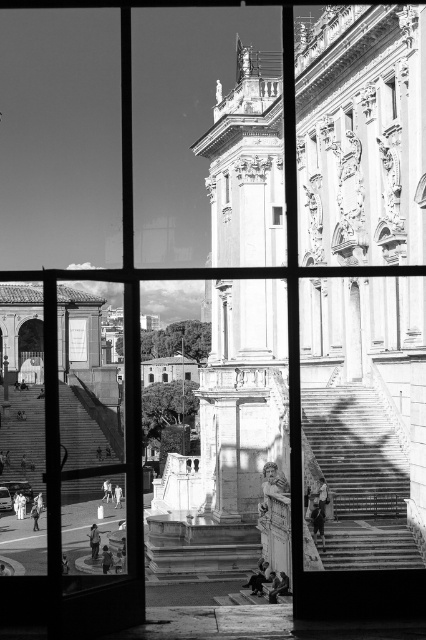
You are standing in front of a window divided into six sections by a grid. You notice two points marked on the window glass at coordinates point (313, 410) and point (66, 499). If you were to touch both points with your finger, which point would require your finger to be closer to the window?

Point (66, 499) would require your finger to be closer to the window because it is closer to the viewer than point (313, 410).

You are standing at the stone staircase at lower left and want to reach the transparent glass window at center. Given that the average walking speed is 1.4 meters per second, how many seconds will it take to walk directly to the window?

The distance between the stone staircase at lower left and the transparent glass window at center is 45.01 meters. At an average walking speed of 1.4 meters per second, it would take approximately 32.15 seconds to walk directly to the window.

You are standing inside a room and looking through the transparent glass window at center. You want to walk towards the stone staircase at lower left. Which direction should you move relative to the window?

Since the stone staircase at lower left is in front of the transparent glass window at center, you should move towards the lower left direction relative to the window to reach it.